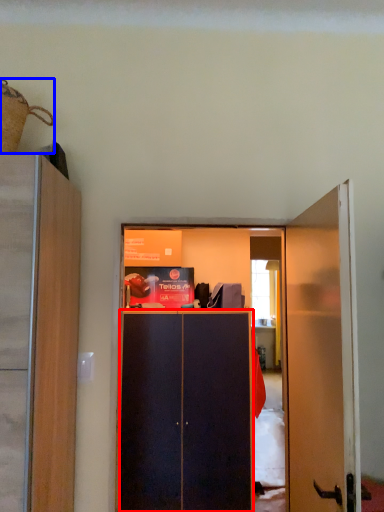
Question: Which object is closer to the camera taking this photo, screen door (highlighted by a red box) or houseplant (highlighted by a blue box)?

Choices:
 (A) screen door
 (B) houseplant

Answer: (B)